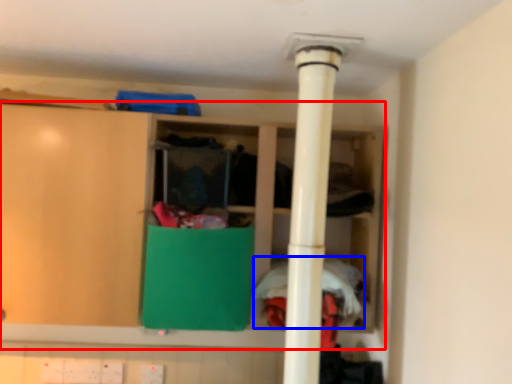
Question: Which point is further to the camera, cupboard (highlighted by a red box) or clothing (highlighted by a blue box)?

Choices:
 (A) cupboard
 (B) clothing

Answer: (A)